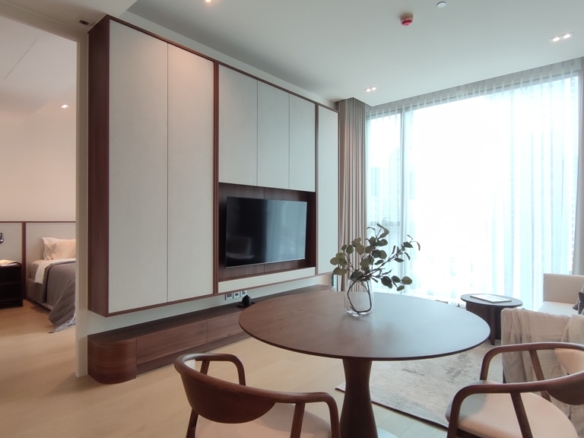
This screenshot has height=438, width=584. I want to click on storage, so click(183, 160).